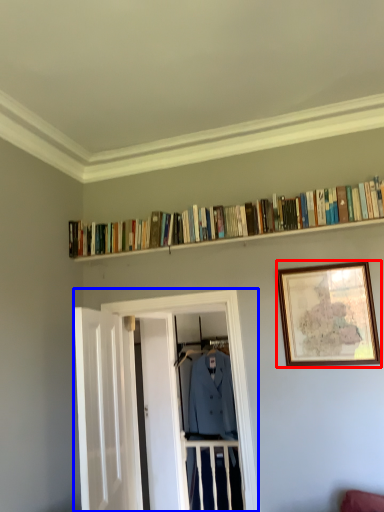
Question: Which object appears farthest to the camera in this image, picture frame (highlighted by a red box) or glass door (highlighted by a blue box)?

Choices:
 (A) picture frame
 (B) glass door

Answer: (B)